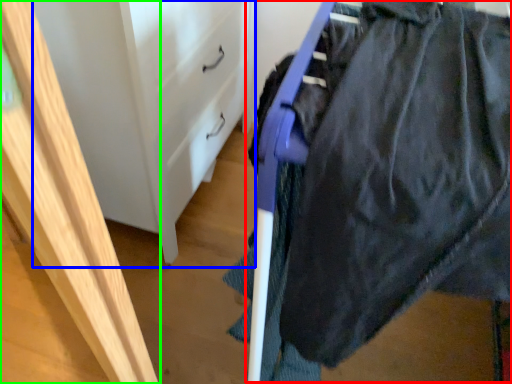
Question: Estimate the real-world distances between objects in this image. Which object is farther from wide (highlighted by a red box), file cabinet (highlighted by a blue box) or furniture (highlighted by a green box)?

Choices:
 (A) file cabinet
 (B) furniture

Answer: (A)